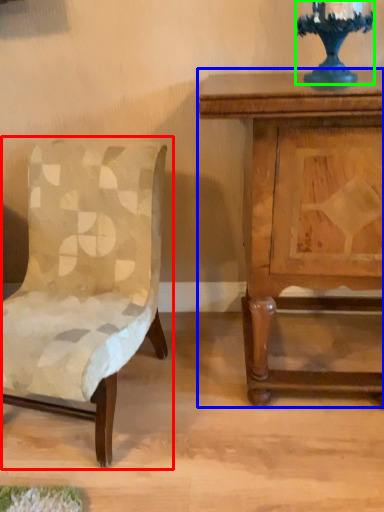
Question: Which object is positioned farthest from chair (highlighted by a red box)? Select from nightstand (highlighted by a blue box) and candle holder (highlighted by a green box).

Choices:
 (A) nightstand
 (B) candle holder

Answer: (B)